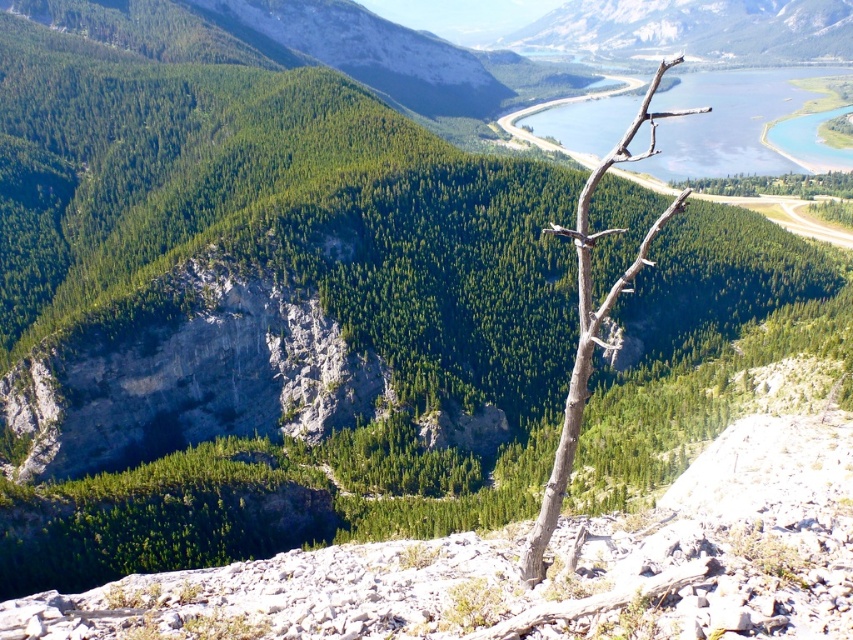
You are a hiker standing at the base of the brown rough branch at center. Looking towards the blue water at upper right, how does its height compare to the branch?

The blue water at upper right is not as tall as the brown rough branch at center, so it is shorter in height compared to the branch.

You are a hiker planning to take a photo of the green forested mountain at upper right. Your camera has a maximum focus range of 700 meters. Will you be able to capture the mountain clearly?

The green forested mountain at upper right is 711.72 meters away from the camera, which exceeds the maximum focus range of 700 meters. Therefore, the mountain may not be captured clearly.

You are standing at the vantage point and see two points marked in the image. Which point is closer to you, point (605, 141) or point (717, 54)?

Point (605, 141) is in front of point (717, 54), so it is closer to you.